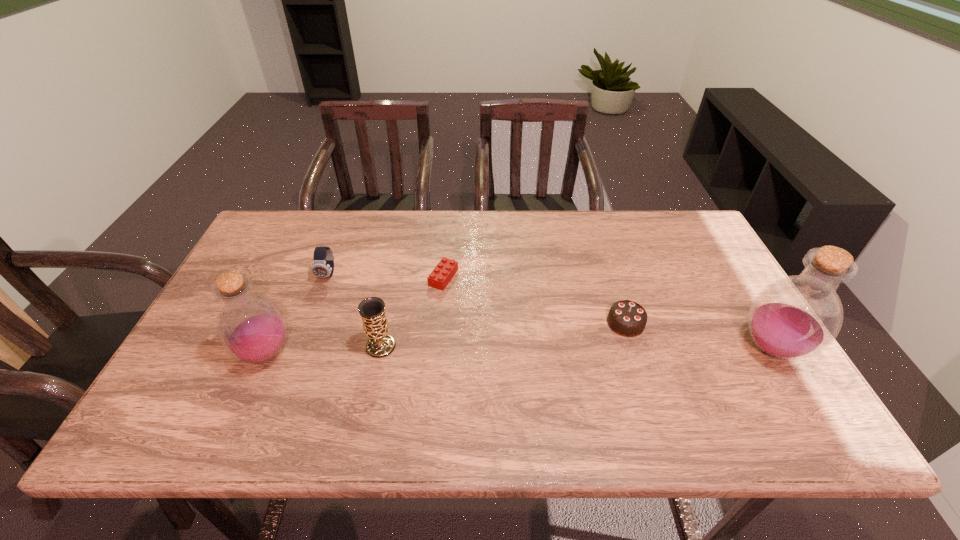
Identify the location of object located at the near right corner. (796, 317).

Identify the location of vacant area at the far edge. (420, 227).

This screenshot has width=960, height=540. What are the coordinates of `vacant space at the near edge` in the screenshot? It's located at (240, 389).

In the image, there is a desktop. Where is `free space at the right edge`? free space at the right edge is located at coordinates (700, 334).

In order to click on vacant space at the far left corner in this screenshot , I will do `click(261, 254)`.

Image resolution: width=960 pixels, height=540 pixels. I want to click on vacant position at the near right corner of the desktop, so click(718, 370).

Find the location of `vacant space that's between the third shortest object and the left bottle`. vacant space that's between the third shortest object and the left bottle is located at coordinates (298, 314).

The image size is (960, 540). Find the location of `empty location between the fourth object from right to left and the shortest object`. empty location between the fourth object from right to left and the shortest object is located at coordinates (412, 312).

Find the location of a particular element. The width and height of the screenshot is (960, 540). free space between the chocolate cake and the watch is located at coordinates (477, 299).

Identify the location of empty location between the second shortest object and the fourth object from right to left. (503, 335).